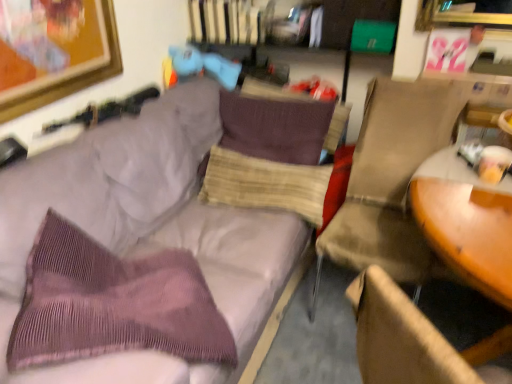
Question: Can you confirm if beige fabric chair at right is smaller than matte blue plush at upper center?

Choices:
 (A) no
 (B) yes

Answer: (A)

Question: Considering the relative positions of beige fabric chair at right and matte blue plush at upper center in the image provided, is beige fabric chair at right to the right of matte blue plush at upper center from the viewer's perspective?

Choices:
 (A) yes
 (B) no

Answer: (A)

Question: Is the depth of beige fabric chair at right less than that of matte blue plush at upper center?

Choices:
 (A) no
 (B) yes

Answer: (B)

Question: Considering the relative sizes of beige fabric chair at right and matte blue plush at upper center in the image provided, is beige fabric chair at right thinner than matte blue plush at upper center?

Choices:
 (A) yes
 (B) no

Answer: (B)

Question: Is beige fabric chair at right outside matte blue plush at upper center?

Choices:
 (A) yes
 (B) no

Answer: (A)

Question: Considering the relative sizes of beige fabric chair at right and matte blue plush at upper center in the image provided, is beige fabric chair at right wider than matte blue plush at upper center?

Choices:
 (A) yes
 (B) no

Answer: (A)

Question: Does purple corduroy throw pillow at left have a larger size compared to beige fabric chair at right?

Choices:
 (A) yes
 (B) no

Answer: (A)

Question: Is purple corduroy throw pillow at left thinner than beige fabric chair at right?

Choices:
 (A) no
 (B) yes

Answer: (B)

Question: Are purple corduroy throw pillow at left and beige fabric chair at right making contact?

Choices:
 (A) no
 (B) yes

Answer: (A)

Question: From a real-world perspective, does purple corduroy throw pillow at left stand above beige fabric chair at right?

Choices:
 (A) yes
 (B) no

Answer: (B)

Question: Can you confirm if purple corduroy throw pillow at left is wider than beige fabric chair at right?

Choices:
 (A) yes
 (B) no

Answer: (B)

Question: Is purple corduroy throw pillow at left oriented towards beige fabric chair at right?

Choices:
 (A) no
 (B) yes

Answer: (B)

Question: Is matte blue plush at upper center aimed at purple corduroy couch at upper left?

Choices:
 (A) no
 (B) yes

Answer: (A)